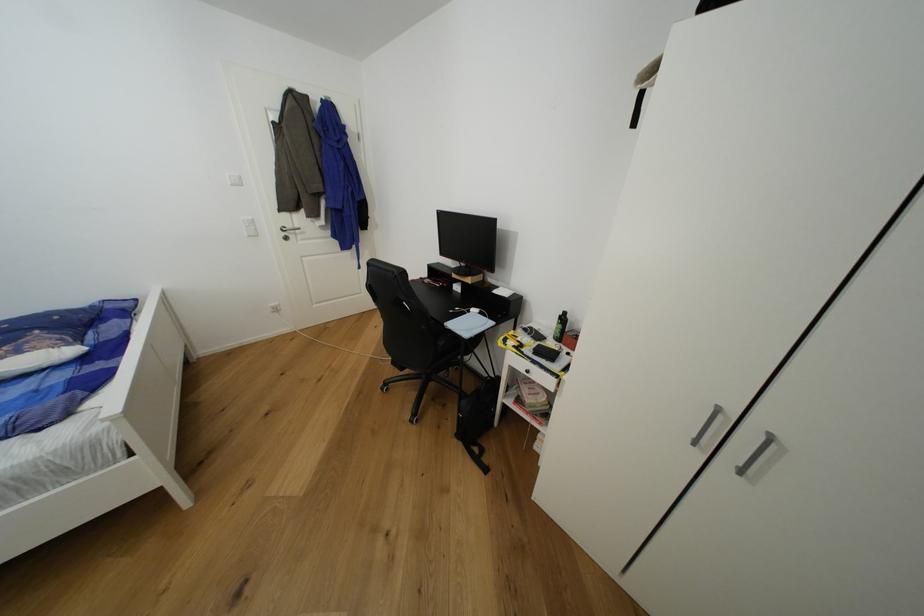
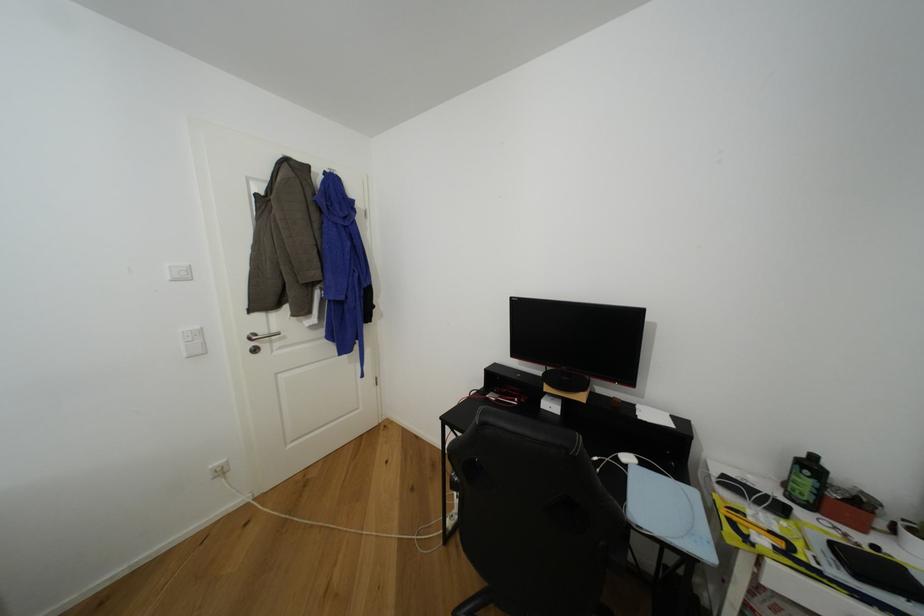
Where in the second image is the point corresponding to (x=244, y=185) from the first image?

(190, 278)